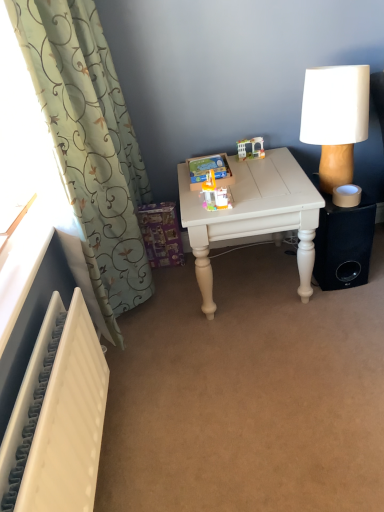
Question: Considering the positions of translucent plastic toy house at upper center, positioned as the first toy in back-to-front order, and white fabric-covered lamp at right in the image, is translucent plastic toy house at upper center, positioned as the first toy in back-to-front order, wider or thinner than white fabric-covered lamp at right?

Choices:
 (A) thin
 (B) wide

Answer: (A)

Question: Visually, is translucent plastic toy house at upper center, the second toy viewed from the front, positioned to the left or to the right of white fabric-covered lamp at right?

Choices:
 (A) left
 (B) right

Answer: (A)

Question: Estimate the real-world distances between objects in this image. Which object is farther from the translucent plastic toy house at upper center, the 1th toy in the top-to-bottom sequence?

Choices:
 (A) translucent plastic toy at center, the 1th toy in the front-to-back sequence
 (B) white textured radiator at lower left
 (C) white painted wood table at center
 (D) white fabric-covered lamp at right
 (E) black matte speaker at lower right

Answer: (B)

Question: Considering the real-world distances, which object is farthest from the translucent plastic toy house at upper center, positioned as the first toy in back-to-front order?

Choices:
 (A) green fabric curtain at left
 (B) white fabric-covered lamp at right
 (C) white painted wood table at center
 (D) black matte speaker at lower right
 (E) white textured radiator at lower left

Answer: (E)